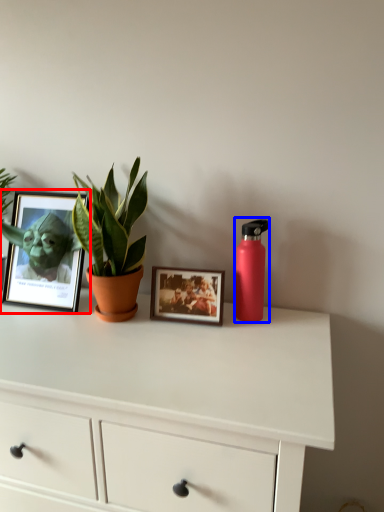
Question: Which point is closer to the camera, picture frame (highlighted by a red box) or bottle (highlighted by a blue box)?

Choices:
 (A) picture frame
 (B) bottle

Answer: (B)